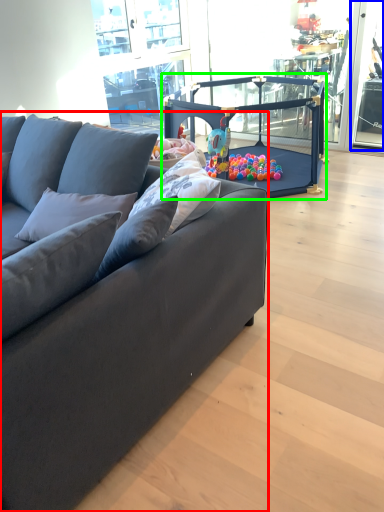
Question: Based on their relative distances, which object is farther from studio couch (highlighted by a red box)? Choose from window screen (highlighted by a blue box) and baby carriage (highlighted by a green box).

Choices:
 (A) window screen
 (B) baby carriage

Answer: (A)